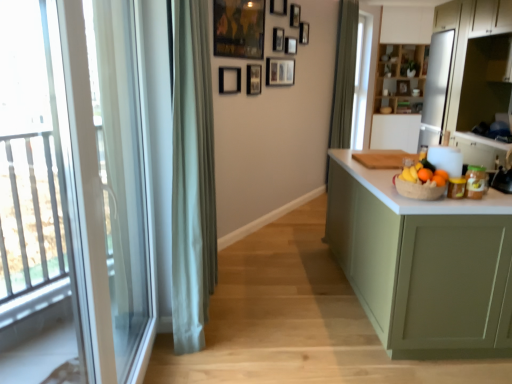
Locate an element on the screen. free spot to the right of orange matte at right, which is counted as the 2th orange, starting from the right is located at coordinates (464, 198).